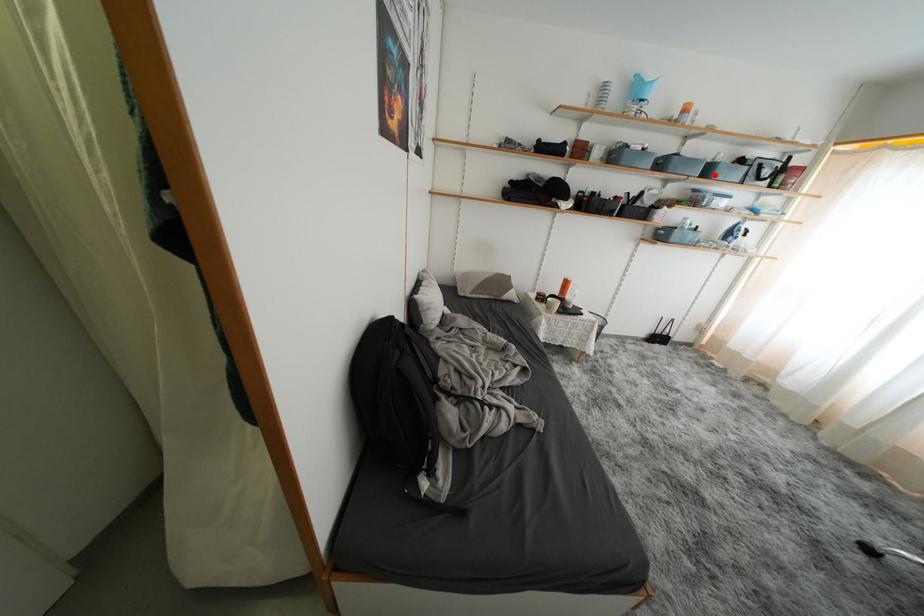
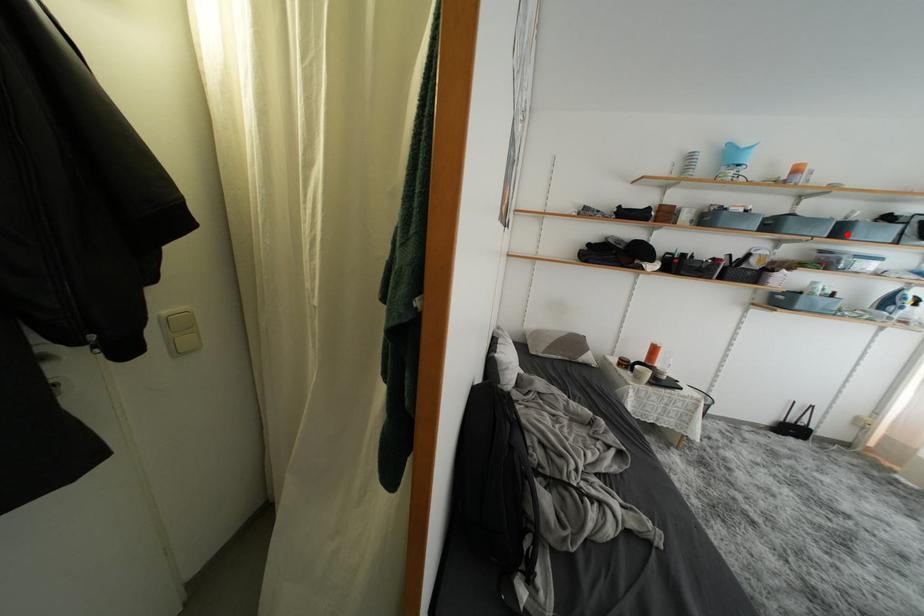
I am providing you with two images of the same scene from different viewpoints. A red point is marked on the first image and another point is marked on the second image. Is the red point in image1 aligned with the point shown in image2?

Yes